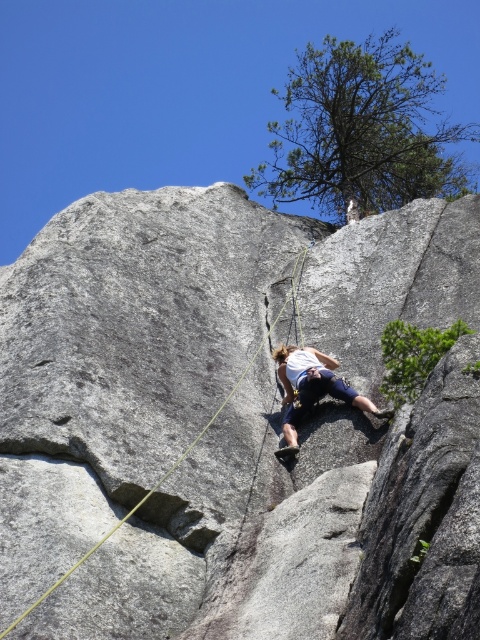
You are a safety inspector checking the climbing setup. The gray rock at center is where the climber is currently attached. Given that the white fabric climbing harness at center must be at least half the width of the anchor point to ensure stability, does the current setup meet safety standards?

The gray rock at center is wider than the white fabric climbing harness at center. Since the harness only needs to be half the width of the anchor point, the setup meets safety standards as the harness is sufficiently wide relative to the rock.

You are a rock climber preparing to ascend a steep granite face. You notice the gray rock at center and the white fabric climbing harness at center. Which object is positioned higher in the image?

The gray rock at center is located above the white fabric climbing harness at center, so it is positioned higher in the image.

You are a safety officer assessing the climbing site. The safety protocol requires that the distance between the climber and the nearest stable anchor point must be within 100 feet. Given that the climber is at the gray rock at center, can they safely proceed without violating the protocol?

The gray rock at center is 124.64 feet away from the viewer, which exceeds the 100 feet safety protocol requirement. Therefore, the climber cannot safely proceed without violating the protocol.